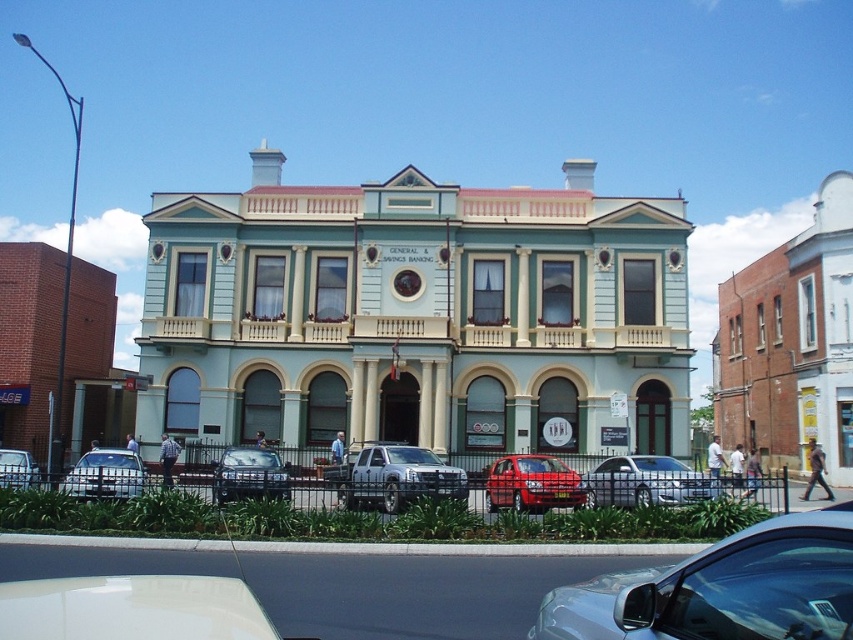
Question: Which point appears closest to the camera in this image?

Choices:
 (A) (260, 472)
 (B) (613, 620)
 (C) (490, 472)

Answer: (B)

Question: Which point appears farthest from the camera in this image?

Choices:
 (A) (497, 502)
 (B) (9, 484)
 (C) (119, 481)
 (D) (720, 490)

Answer: (A)

Question: Is metallic teal car at lower right to the left of silver metallic pickup truck at center from the viewer's perspective?

Choices:
 (A) yes
 (B) no

Answer: (B)

Question: Among these objects, which one is nearest to the camera?

Choices:
 (A) metallic teal car at lower right
 (B) matte silver sedan at lower left
 (C) silver metallic sedan at lower left
 (D) shiny red sedan at center

Answer: (A)

Question: Does metallic teal car at lower right appear on the left side of silver metallic sedan at lower left?

Choices:
 (A) yes
 (B) no

Answer: (B)

Question: Does shiny red sedan at center appear under matte silver sedan at lower left?

Choices:
 (A) yes
 (B) no

Answer: (A)